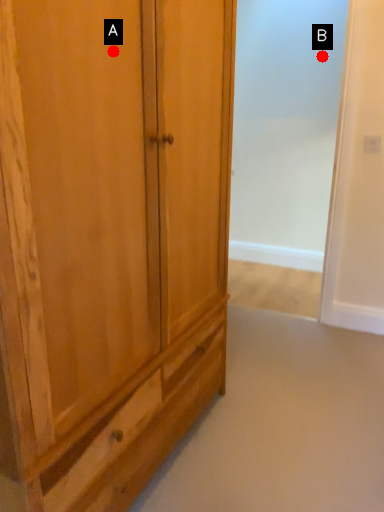
Question: Two points are circled on the image, labeled by A and B beside each circle. Among these points, which one is nearest to the camera?

Choices:
 (A) A is closer
 (B) B is closer

Answer: (A)